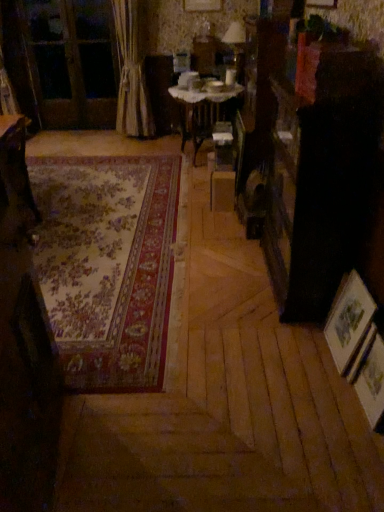
Where is `vacant region in front of beige fabric curtain at left`? The height and width of the screenshot is (512, 384). vacant region in front of beige fabric curtain at left is located at coordinates click(137, 145).